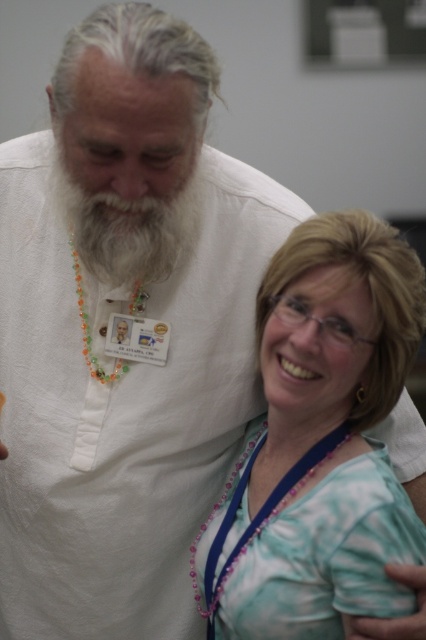
Question: Which of the following is the farthest from the observer?

Choices:
 (A) teal fabric shirt at lower right
 (B) white soft beard at center

Answer: (B)

Question: Is teal fabric shirt at lower right closer to camera compared to white soft beard at center?

Choices:
 (A) yes
 (B) no

Answer: (A)

Question: Can you confirm if teal fabric shirt at lower right is bigger than white soft beard at center?

Choices:
 (A) yes
 (B) no

Answer: (A)

Question: Among these objects, which one is nearest to the camera?

Choices:
 (A) teal fabric shirt at lower right
 (B) white soft beard at center

Answer: (A)

Question: In this image, where is teal fabric shirt at lower right located relative to white soft beard at center?

Choices:
 (A) above
 (B) below

Answer: (B)